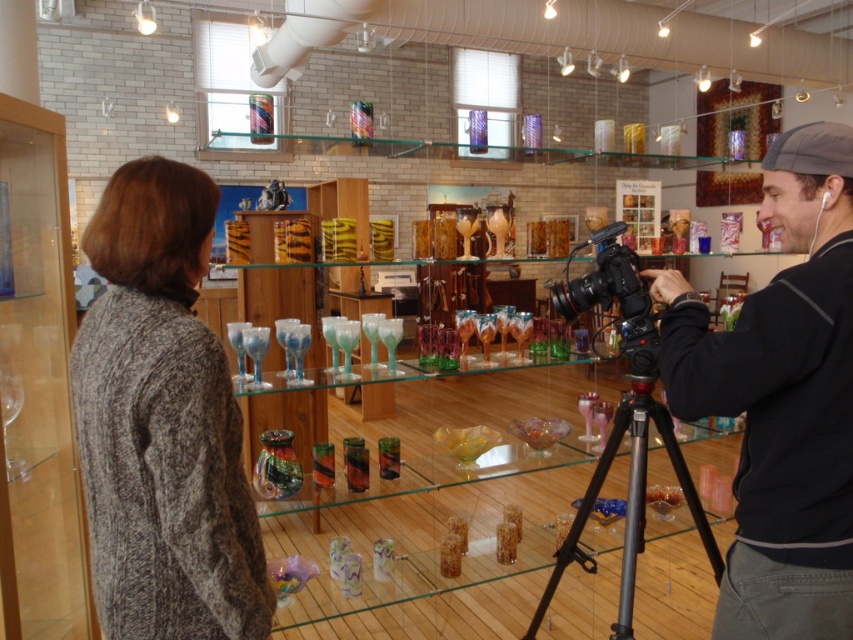
Is knitted gray sweater at left shorter than black matte camera at center?

Yes, knitted gray sweater at left is shorter than black matte camera at center.

Is point (135, 412) in front of point (701, 397)?

That is True.

Where is `knitted gray sweater at left`? Image resolution: width=853 pixels, height=640 pixels. knitted gray sweater at left is located at coordinates (161, 422).

Is black metal tripod at center further to camera compared to black plastic video camera at center?

No, it is in front of black plastic video camera at center.

Which is more to the right, black metal tripod at center or black plastic video camera at center?

Positioned to the right is black metal tripod at center.

Does point (625, 545) come farther from viewer compared to point (625, 227)?

No, (625, 545) is in front of (625, 227).

Where is `black metal tripod at center`? This screenshot has height=640, width=853. black metal tripod at center is located at coordinates (630, 502).

Does knitted gray sweater at left appear on the left side of black metal tripod at center?

Correct, you'll find knitted gray sweater at left to the left of black metal tripod at center.

Is knitted gray sweater at left above black metal tripod at center?

Yes, knitted gray sweater at left is above black metal tripod at center.

Is point (134, 221) farther from camera compared to point (712, 547)?

No, (134, 221) is in front of (712, 547).

Where is `knitted gray sweater at left`? This screenshot has width=853, height=640. knitted gray sweater at left is located at coordinates (161, 422).